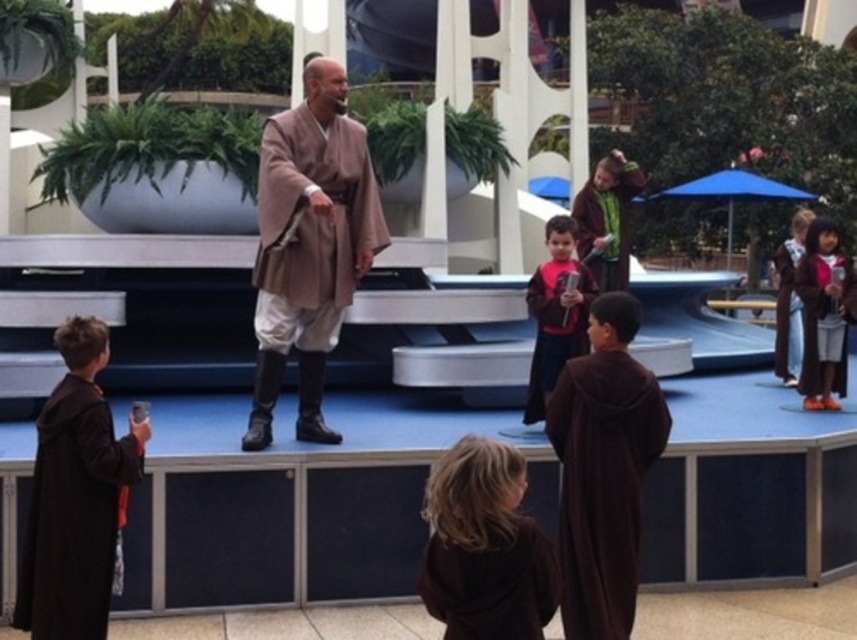
You are a photographer at the event and want to capture both the brown velvety robe at center and the pink fabric shirt at center in a single shot. Which object should you focus on first to ensure both are in clear view?

You should focus on the brown velvety robe at center first since it is closer to the viewer than the pink fabric shirt at center, ensuring both will be in focus when focusing on the closer object.

Based on the photo, you are a costume designer observing the stage setup. You need to determine which robe, the matte brown robe at center or the brown fuzzy robe at center, belongs to the taller individual. Based on the scene description, which robe is associated with the taller person?

The matte brown robe at center is much taller than the brown fuzzy robe at center, so the matte brown robe at center belongs to the taller individual.

You are standing at the origin point of the coordinate system in the image. The brown velvety robe at center is located at coordinates approximately 0.759 on the x axis and 0.704 on the y axis. If you want to walk directly to the robe, in which direction should you move first?

Since the brown velvety robe at center is located at coordinates approximately 0.759 on the x axis and 0.704 on the y axis, you should move northeast first. This is because the x coordinate is positive to the right and the y coordinate is positive upwards, so moving northeast would align with both increasing x and y values to reach the robe.